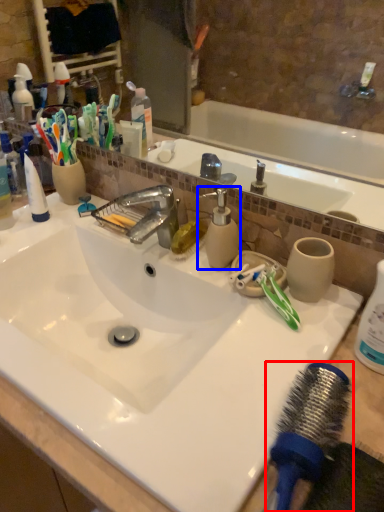
Question: Which object is further to the camera taking this photo, hair drier (highlighted by a red box) or soap dispenser (highlighted by a blue box)?

Choices:
 (A) hair drier
 (B) soap dispenser

Answer: (B)